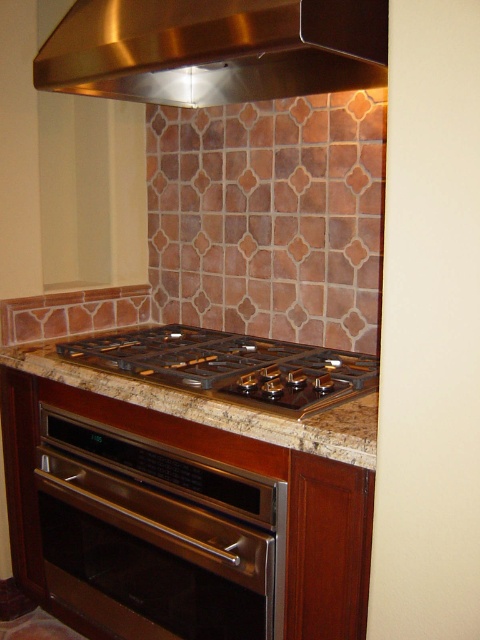
You are a delivery person holding a 1.5 meter long package and need to place it on the countertop in the kitchen. The stainless steel oven at lower left is in your way. Can you slide the package past the oven without tilting it?

The stainless steel oven at lower left is 1.35 meters away from the camera. Since the package is 1.5 meters long, it would extend beyond the oven by 15 centimeters. Therefore, you can slide the package past the oven without tilting it as there is enough space.

You are standing in the kitchen and want to reach both the stainless steel oven at lower left and the stainless steel exhaust hood at upper center. Which one will you need to move closer to first?

You will need to move closer to the stainless steel oven at lower left first because it is closer to you than the stainless steel exhaust hood at upper center.